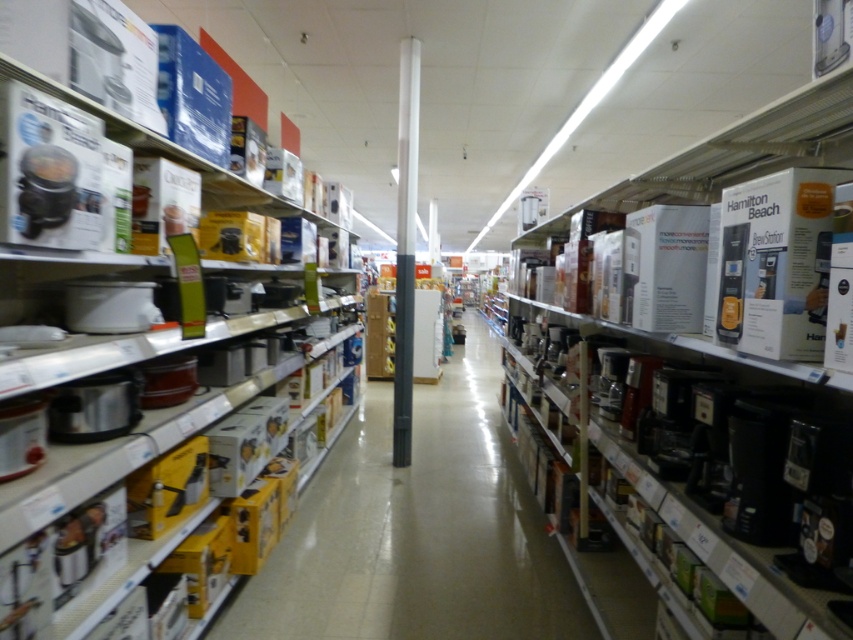
Consider the image. You are a customer in the kitchen appliance aisle. You see the matte black coffee maker at center and the matte white crockpot at upper left. Which one is located to the right of the other?

The matte black coffee maker at center is positioned on the right side of the matte white crockpot at upper left.

You are a store employee organizing the kitchen appliance section. You need to place a new matte black coffee maker at center and a matte white crockpot at upper left on the shelf. Given that the shelf has limited space, which item requires more space due to its size?

The matte black coffee maker at center requires more space because it is larger in size than the matte white crockpot at upper left.

You are standing in the middle of the retail store aisle and want to find the matte black coffee maker at center. According to the store layout, where should you look relative to the central support column?

The matte black coffee maker at center is located at coordinates 0.828 on the x axis and 0.491 on the y axis relative to the central support column.